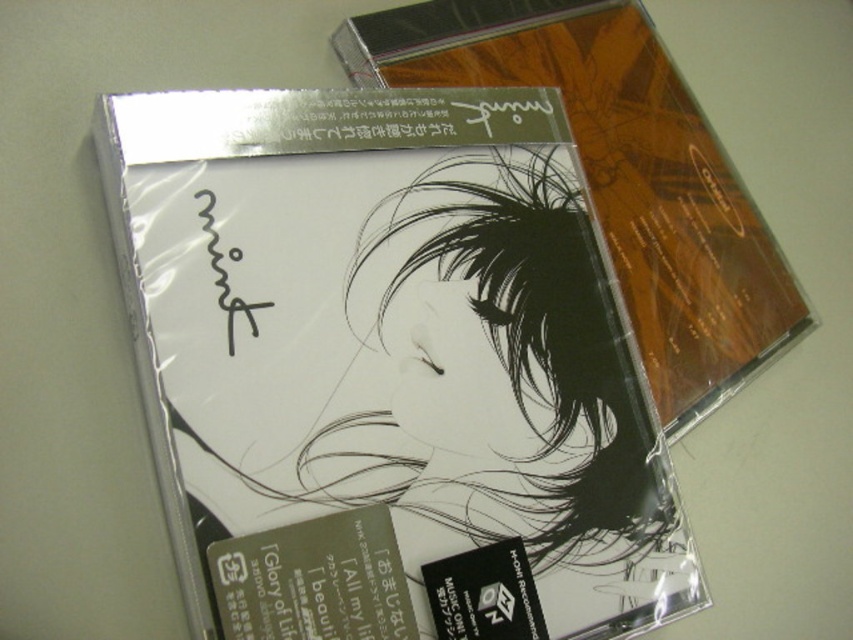
Question: Is white paper at center further to the viewer compared to matte plastic cd case at center?

Choices:
 (A) yes
 (B) no

Answer: (B)

Question: Can you confirm if white paper at center is thinner than matte plastic cd case at center?

Choices:
 (A) yes
 (B) no

Answer: (B)

Question: Which of the following is the farthest from the observer?

Choices:
 (A) (368, 163)
 (B) (693, 256)

Answer: (B)

Question: Among these points, which one is farthest from the camera?

Choices:
 (A) (361, 483)
 (B) (554, 10)

Answer: (B)

Question: Which object is closer to the camera taking this photo?

Choices:
 (A) white paper at center
 (B) matte plastic cd case at center

Answer: (A)

Question: Can you confirm if white paper at center is positioned to the right of matte plastic cd case at center?

Choices:
 (A) yes
 (B) no

Answer: (B)